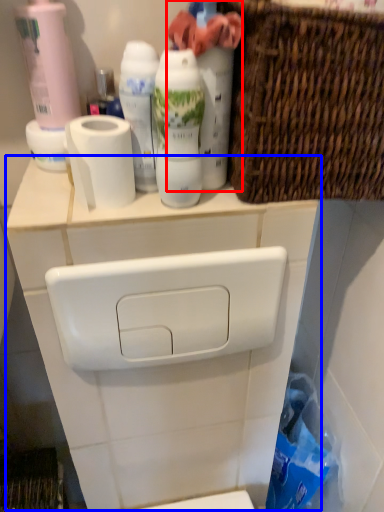
Question: Which point is further to the camera, cleaning product (highlighted by a red box) or counter (highlighted by a blue box)?

Choices:
 (A) cleaning product
 (B) counter

Answer: (B)